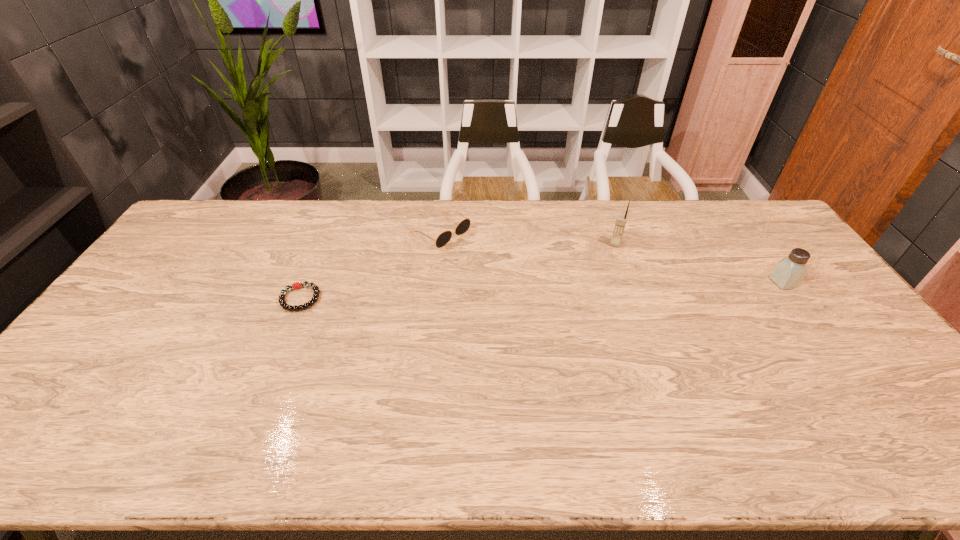
At what (x,y) coordinates should I click in order to perform the action: click on vacant area that lies between the sunglasses and the saltshaker. Please return your answer as a coordinate pair (x, y). The image size is (960, 540). Looking at the image, I should click on (612, 257).

You are a GUI agent. You are given a task and a screenshot of the screen. Output one action in this format:
    pyautogui.click(x=<x>, y=<y>)
    Task: Click on the empty space that is in between the third object from right to left and the leftmost object
    This screenshot has height=540, width=960.
    Given the screenshot: What is the action you would take?
    pyautogui.click(x=371, y=265)

The width and height of the screenshot is (960, 540). I want to click on free space between the tallest object and the shortest object, so click(458, 271).

At what (x,y) coordinates should I click in order to perform the action: click on object that is the third closest to the second object from left to right. Please return your answer as a coordinate pair (x, y). Looking at the image, I should click on (789, 272).

Find the location of a particular element. object that stands as the second closest to the second tallest object is located at coordinates (464, 225).

Where is `vacant position in the image that satisfies the following two spatial constraints: 1. on the back side of the third object from right to left; 2. on the right side of the bracelet`? Image resolution: width=960 pixels, height=540 pixels. vacant position in the image that satisfies the following two spatial constraints: 1. on the back side of the third object from right to left; 2. on the right side of the bracelet is located at coordinates (327, 232).

Where is `vacant space that satisfies the following two spatial constraints: 1. on the back side of the bracelet; 2. on the left side of the tallest object`? vacant space that satisfies the following two spatial constraints: 1. on the back side of the bracelet; 2. on the left side of the tallest object is located at coordinates (323, 244).